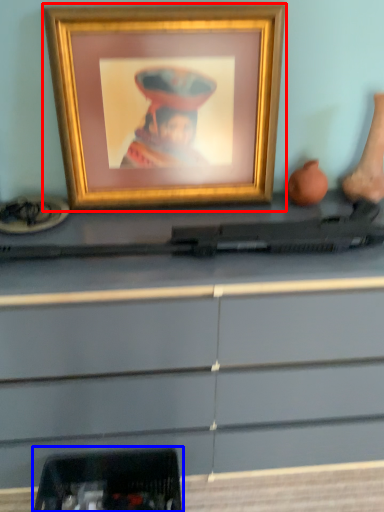
Question: Which point is closer to the camera, picture frame (highlighted by a red box) or equipment (highlighted by a blue box)?

Choices:
 (A) picture frame
 (B) equipment

Answer: (A)